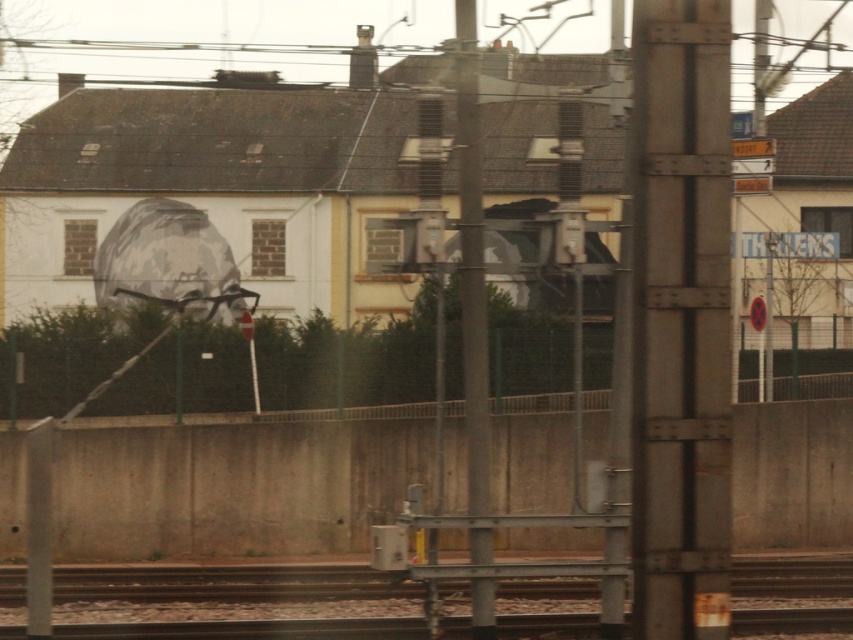
You are a photographer trying to capture the metallic gray pole at center and the smooth metal train track at center in the same frame. Based on their positions, which object should you adjust your camera to focus on first if you want to ensure both are in the shot?

The smooth metal train track at center is to the left of the metallic gray pole at center, so you should focus on the metallic gray pole at center first to ensure both are in the frame.

From the picture: You are a photographer trying to capture both the rusty metal pole at center and the metallic gray pole at center in a single frame. Based on their sizes, which pole should you focus on to ensure both are clearly visible in the photo?

The rusty metal pole at center is larger in size than the metallic gray pole at center, so focusing on the rusty metal pole at center will help ensure both poles are clearly visible in the photo.